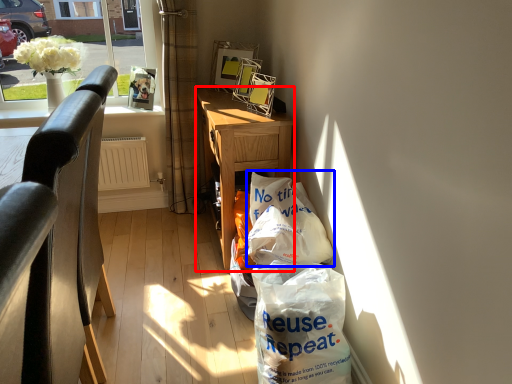
Question: Which object appears farthest to the camera in this image, desk (highlighted by a red box) or grocery bag (highlighted by a blue box)?

Choices:
 (A) desk
 (B) grocery bag

Answer: (A)